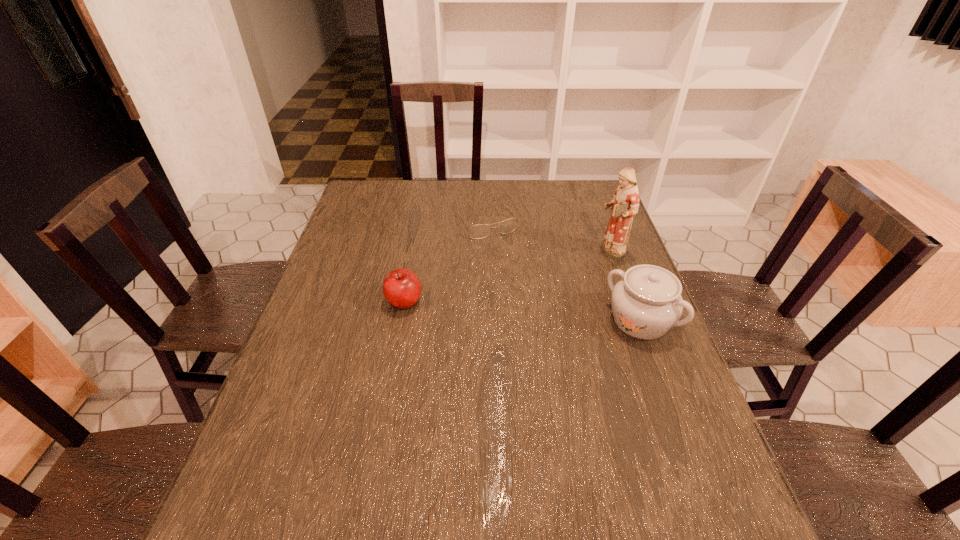
Select which object is the closest to the third nearest object. Please provide its 2D coordinates. Your answer should be formatted as a tuple, i.e. [(x, y)], where the tuple contains the x and y coordinates of a point satisfying the conditions above.

[(646, 303)]

Image resolution: width=960 pixels, height=540 pixels. What are the coordinates of `object that ranks as the closest to the farthest object` in the screenshot? It's located at (625, 203).

This screenshot has height=540, width=960. What are the coordinates of `vacant space that satisfies the following two spatial constraints: 1. on the front side of the third nearest object; 2. on the left side of the third shortest object` in the screenshot? It's located at (636, 321).

The height and width of the screenshot is (540, 960). Find the location of `vacant area in the image that satisfies the following two spatial constraints: 1. on the front side of the spectacles; 2. on the left side of the figurine`. vacant area in the image that satisfies the following two spatial constraints: 1. on the front side of the spectacles; 2. on the left side of the figurine is located at coordinates (487, 253).

Where is `free point that satisfies the following two spatial constraints: 1. on the front side of the second tallest object; 2. on the right side of the leftmost object`? Image resolution: width=960 pixels, height=540 pixels. free point that satisfies the following two spatial constraints: 1. on the front side of the second tallest object; 2. on the right side of the leftmost object is located at coordinates (400, 321).

The width and height of the screenshot is (960, 540). Find the location of `free space that satisfies the following two spatial constraints: 1. on the front side of the second object from left to right; 2. on the left side of the third nearest object`. free space that satisfies the following two spatial constraints: 1. on the front side of the second object from left to right; 2. on the left side of the third nearest object is located at coordinates (487, 253).